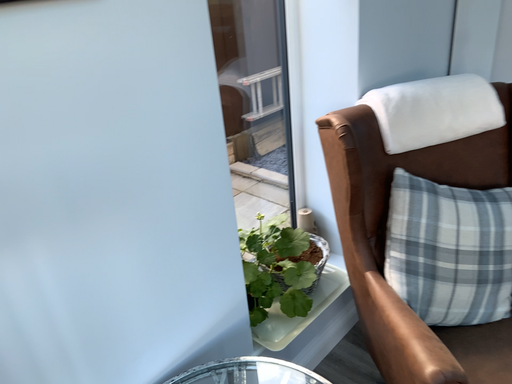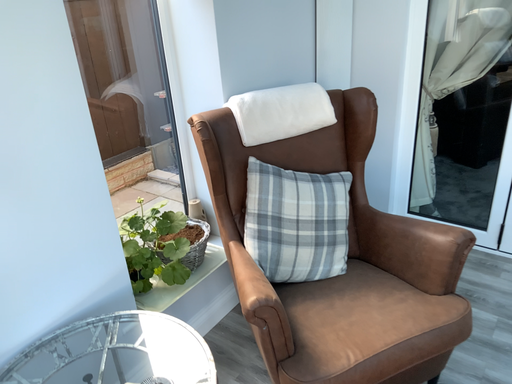
Question: How did the camera likely rotate when shooting the video?

Choices:
 (A) rotated right
 (B) rotated left

Answer: (A)